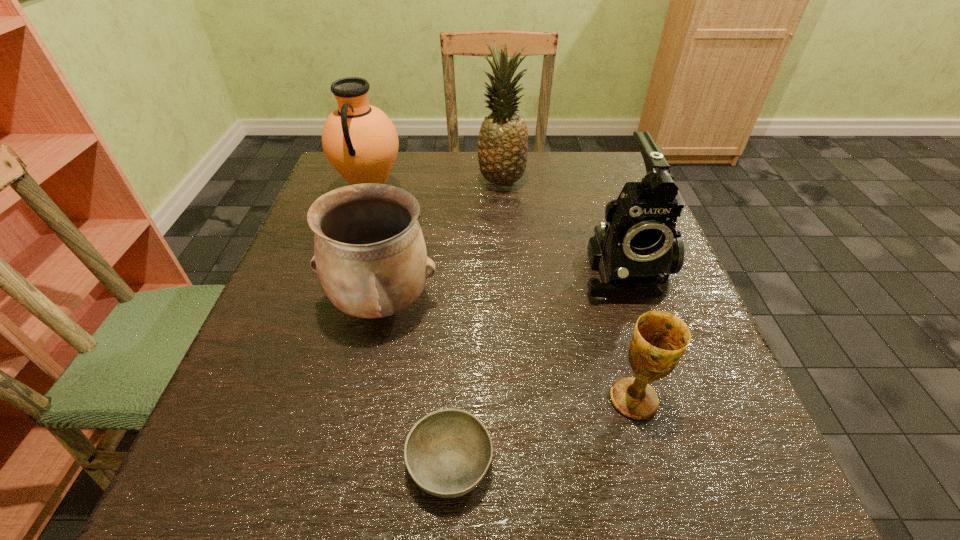
You are a GUI agent. You are given a task and a screenshot of the screen. Output one action in this format:
    pyautogui.click(x=<x>, y=<y>)
    Task: Click on the blank area located 0.320m on the lens mount of the camcorder
    The width and height of the screenshot is (960, 540).
    Given the screenshot: What is the action you would take?
    pyautogui.click(x=693, y=475)

Locate an element on the screen. free space located on the back of the third shortest object is located at coordinates (406, 190).

Where is `vacant space located 0.170m on the back of the second shortest object`? This screenshot has width=960, height=540. vacant space located 0.170m on the back of the second shortest object is located at coordinates (607, 303).

Where is `vacant area situated on the right of the shortest object`? vacant area situated on the right of the shortest object is located at coordinates (647, 463).

You are a GUI agent. You are given a task and a screenshot of the screen. Output one action in this format:
    pyautogui.click(x=<x>, y=<y>)
    Task: Click on the pineapple at the far edge
    This screenshot has height=540, width=960.
    Given the screenshot: What is the action you would take?
    pyautogui.click(x=502, y=150)

This screenshot has height=540, width=960. Identify the location of pitcher that is at the far edge. (360, 141).

Image resolution: width=960 pixels, height=540 pixels. Find the location of `object that is at the near edge`. object that is at the near edge is located at coordinates (448, 452).

The height and width of the screenshot is (540, 960). I want to click on pitcher that is at the left edge, so click(x=360, y=141).

You are a GUI agent. You are given a task and a screenshot of the screen. Output one action in this format:
    pyautogui.click(x=<x>, y=<y>)
    Task: Click on the urn at the left edge
    The height and width of the screenshot is (540, 960).
    Given the screenshot: What is the action you would take?
    pyautogui.click(x=370, y=254)

The width and height of the screenshot is (960, 540). I want to click on camcorder at the right edge, so click(637, 248).